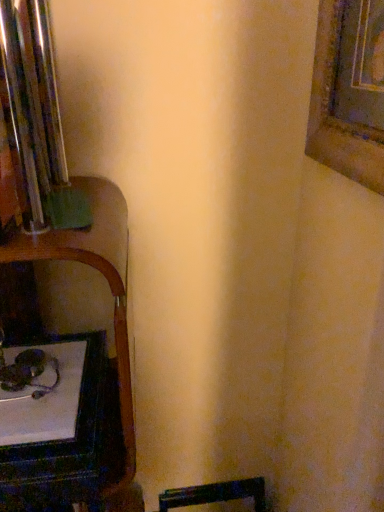
What do you see at coordinates (72, 440) in the screenshot? The width and height of the screenshot is (384, 512). I see `white glossy table at lower left` at bounding box center [72, 440].

The width and height of the screenshot is (384, 512). What are the coordinates of `white glossy table at lower left` in the screenshot? It's located at (72, 440).

Describe the element at coordinates (349, 91) in the screenshot. I see `wooden picture frame at upper right` at that location.

Identify the location of wooden picture frame at upper right. This screenshot has height=512, width=384. (349, 91).

I want to click on white glossy table at lower left, so click(72, 440).

Between white glossy table at lower left and wooden picture frame at upper right, which one appears on the left side from the viewer's perspective?

Positioned to the left is white glossy table at lower left.

Is white glossy table at lower left closer to the viewer compared to wooden picture frame at upper right?

No, white glossy table at lower left is behind wooden picture frame at upper right.

Does point (91, 481) come behind point (363, 124)?

No, (91, 481) is closer to viewer.

From the image's perspective, is white glossy table at lower left on wooden picture frame at upper right?

No, from the image's perspective, white glossy table at lower left is not on top of wooden picture frame at upper right.

Looking at this image, from a real-world perspective, between white glossy table at lower left and wooden picture frame at upper right, who is vertically lower?

From a 3D spatial view, white glossy table at lower left is below.

Considering the relative sizes of white glossy table at lower left and wooden picture frame at upper right in the image provided, is white glossy table at lower left thinner than wooden picture frame at upper right?

No, white glossy table at lower left is not thinner than wooden picture frame at upper right.

Does white glossy table at lower left have a lesser height compared to wooden picture frame at upper right?

Correct, white glossy table at lower left is not as tall as wooden picture frame at upper right.

Looking at the image, does white glossy table at lower left seem bigger or smaller compared to wooden picture frame at upper right?

white glossy table at lower left is bigger than wooden picture frame at upper right.

Is white glossy table at lower left inside the boundaries of wooden picture frame at upper right, or outside?

white glossy table at lower left is located beyond the bounds of wooden picture frame at upper right.

Is white glossy table at lower left not near wooden picture frame at upper right?

No, white glossy table at lower left is not far away from wooden picture frame at upper right.

Is white glossy table at lower left facing away from wooden picture frame at upper right?

No.

Find the location of a particular element. Image resolution: width=384 pixels, height=512 pixels. picture frame that is on the right side of white glossy table at lower left is located at coordinates (349, 91).

Considering the positions of objects wooden picture frame at upper right and white glossy table at lower left in the image provided, who is more to the right, wooden picture frame at upper right or white glossy table at lower left?

Positioned to the right is wooden picture frame at upper right.

Which is behind, wooden picture frame at upper right or white glossy table at lower left?

white glossy table at lower left is more distant.

Considering the positions of points (306, 144) and (97, 347), is point (306, 144) closer to camera compared to point (97, 347)?

No, (306, 144) is behind (97, 347).

From the image's perspective, is wooden picture frame at upper right below white glossy table at lower left?

No.

From a real-world perspective, which object stands above the other?

wooden picture frame at upper right, from a real-world perspective.

Based on the photo, looking at their sizes, would you say wooden picture frame at upper right is wider or thinner than white glossy table at lower left?

In the image, wooden picture frame at upper right appears to be more narrow than white glossy table at lower left.

Looking at this image, which of these two, wooden picture frame at upper right or white glossy table at lower left, stands shorter?

Standing shorter between the two is white glossy table at lower left.

Who is bigger, wooden picture frame at upper right or white glossy table at lower left?

white glossy table at lower left is bigger.

Is wooden picture frame at upper right not inside white glossy table at lower left?

Yes, wooden picture frame at upper right is located beyond the bounds of white glossy table at lower left.

Is there a large distance between wooden picture frame at upper right and white glossy table at lower left?

wooden picture frame at upper right is actually quite close to white glossy table at lower left.

Could you tell me if wooden picture frame at upper right is facing white glossy table at lower left?

No, wooden picture frame at upper right is not aimed at white glossy table at lower left.

How many degrees apart are the facing directions of wooden picture frame at upper right and white glossy table at lower left?

The angular difference between wooden picture frame at upper right and white glossy table at lower left is 90.8 degrees.

Image resolution: width=384 pixels, height=512 pixels. In the image, there is a wooden picture frame at upper right. Identify the location of table below it (from the image's perspective). (72, 440).

Image resolution: width=384 pixels, height=512 pixels. What are the coordinates of `table that is on the left side of wooden picture frame at upper right` in the screenshot? It's located at (72, 440).

Where is `picture frame that appears on the right of white glossy table at lower left`? This screenshot has height=512, width=384. picture frame that appears on the right of white glossy table at lower left is located at coordinates (349, 91).